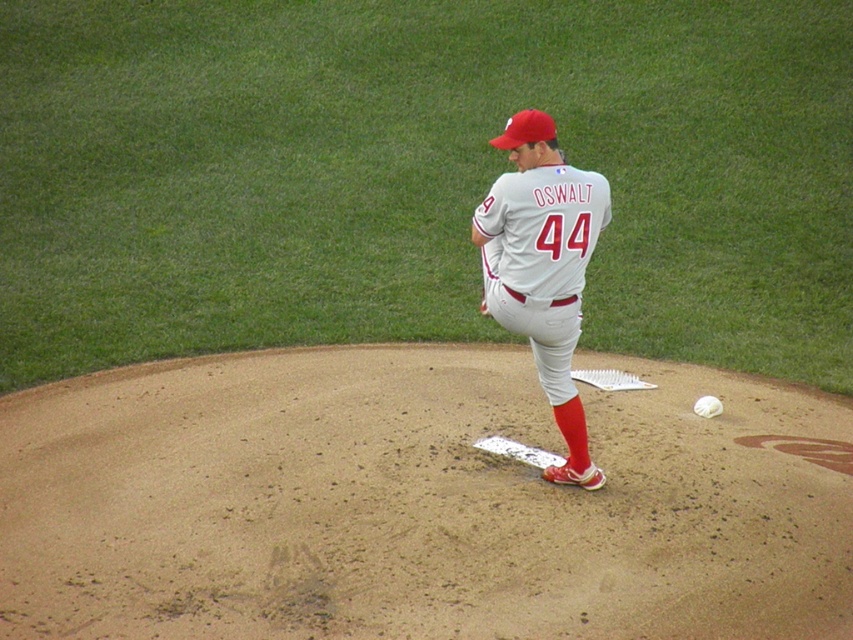
You are a photographer at the baseball game. You want to take a photo that includes both the gray fabric baseball uniform at center and the white matte baseball at center. Which object should you zoom in on to ensure both are clearly visible in the frame?

The gray fabric baseball uniform at center is larger in size than the white matte baseball at center. To ensure both are clearly visible, you should zoom in on the gray fabric baseball uniform at center since it is larger and will remain in focus while the smaller white matte baseball at center will also be captured in the frame.

You are a photographer trying to capture the pitcher in action. You need to ensure both the gray fabric baseball uniform at center and the white matte baseball at center are clearly visible in your shot. Given their sizes, which object will require a closer focus to capture details?

The gray fabric baseball uniform at center is larger than the white matte baseball at center, so you will need to focus closer on the gray fabric baseball uniform at center to capture its details.